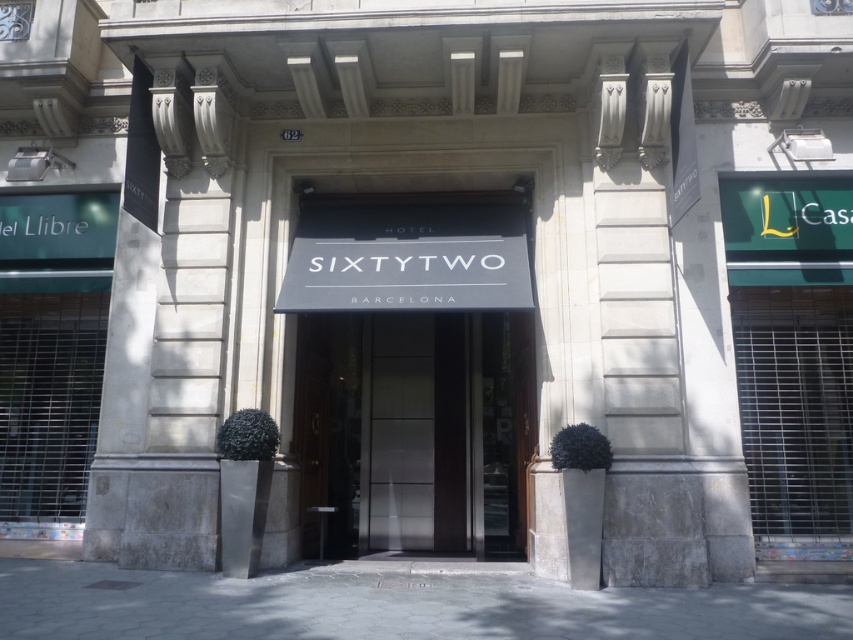
Question: Which of the following is the farthest from the observer?

Choices:
 (A) (505, 410)
 (B) (308, 289)

Answer: (A)

Question: Which point appears farthest from the camera in this image?

Choices:
 (A) (440, 442)
 (B) (320, 252)

Answer: (A)

Question: Which point is closer to the camera?

Choices:
 (A) (381, 298)
 (B) (514, 364)

Answer: (A)

Question: Can you confirm if satin black door at center is positioned below black matte sign at center?

Choices:
 (A) no
 (B) yes

Answer: (B)

Question: Is satin black door at center in front of black matte sign at center?

Choices:
 (A) no
 (B) yes

Answer: (A)

Question: Does satin black door at center have a lesser width compared to black matte sign at center?

Choices:
 (A) no
 (B) yes

Answer: (A)